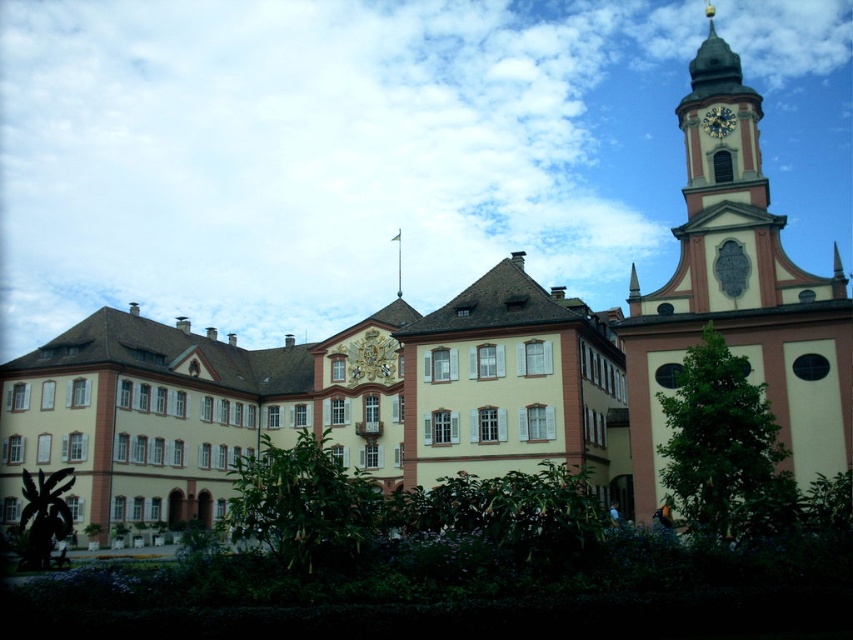
You are an architect analyzing the symmetry of the building. You notice the beige stone clock tower at upper right and the gold metallic clock at upper right. Which of these two objects has a greater width?

The beige stone clock tower at upper right has a greater width than the gold metallic clock at upper right.

You are standing in front of the grand historic building. You want to take a photo that includes the beige stone clock tower at upper right. Where should you position yourself relative to the building to ensure the clock tower is fully visible in your frame?

To ensure the beige stone clock tower at upper right is fully visible in your photo, position yourself such that your camera is aligned with the coordinates approximately at point 0.463 on the horizontal axis and 0.866 on the vertical axis relative to the building.